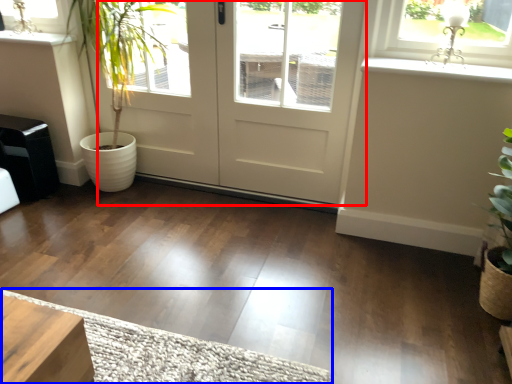
Question: Which object is further to the camera taking this photo, door (highlighted by a red box) or doormat (highlighted by a blue box)?

Choices:
 (A) door
 (B) doormat

Answer: (A)